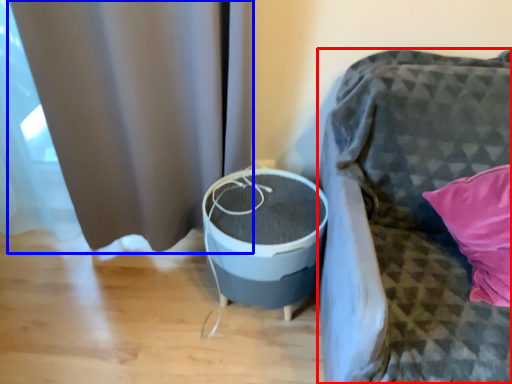
Question: Which of the following is the closest to the observer, furniture (highlighted by a red box) or curtain (highlighted by a blue box)?

Choices:
 (A) furniture
 (B) curtain

Answer: (A)